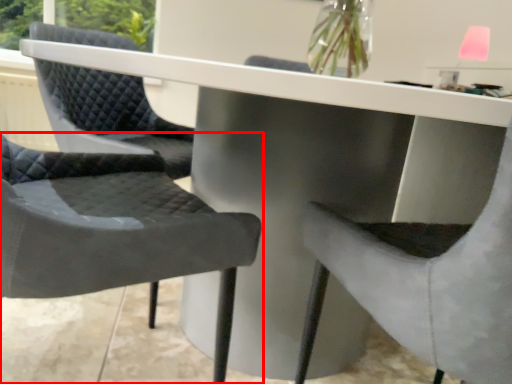
Question: Considering the relative positions of chair (annotated by the red box) and chair in the image provided, where is chair (annotated by the red box) located with respect to the staircase?

Choices:
 (A) left
 (B) right

Answer: (A)